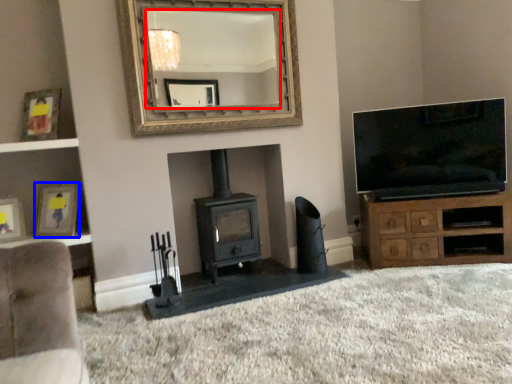
Question: Which object is further to the camera taking this photo, mirror (highlighted by a red box) or picture frame (highlighted by a blue box)?

Choices:
 (A) mirror
 (B) picture frame

Answer: (B)